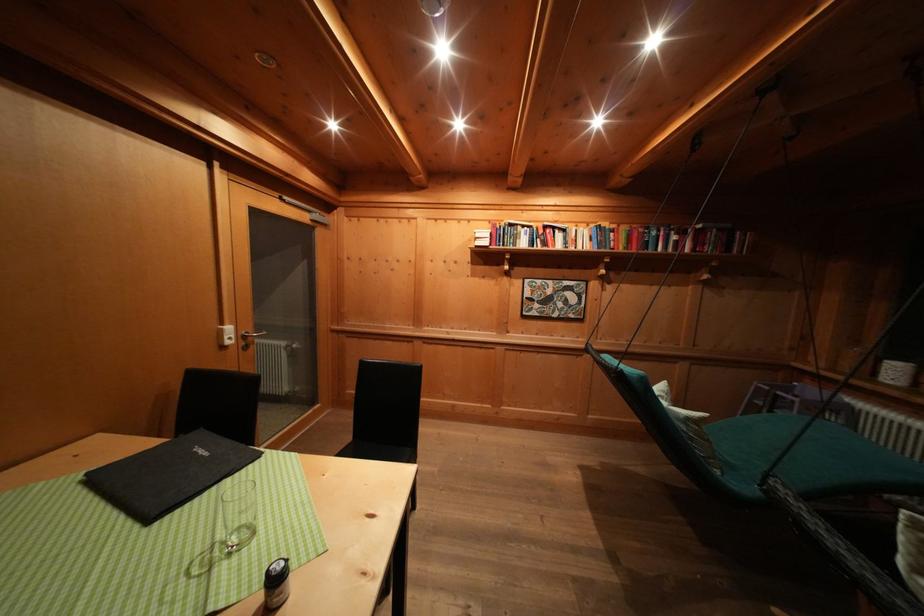
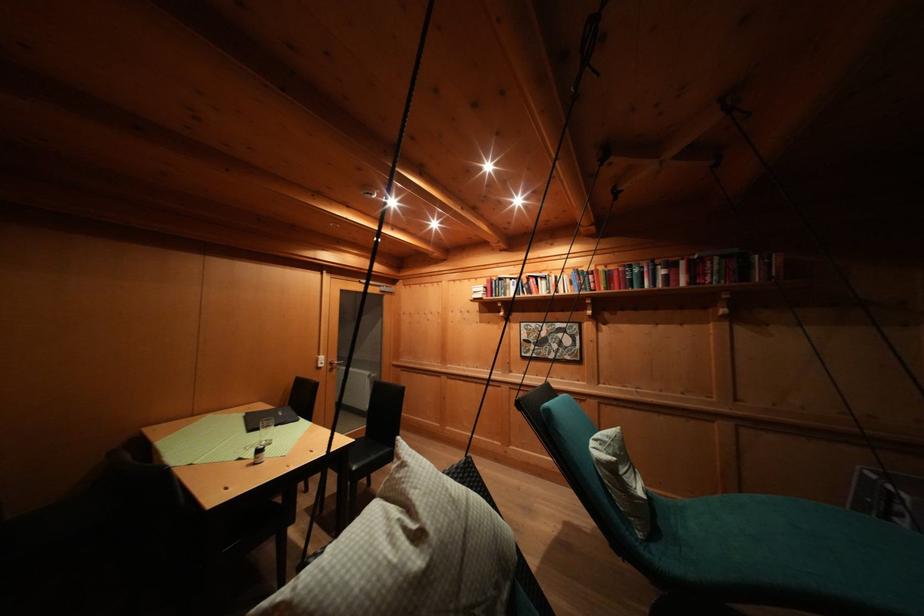
In the second image, find the point that corresponds to [162,515] in the first image.

(259, 434)